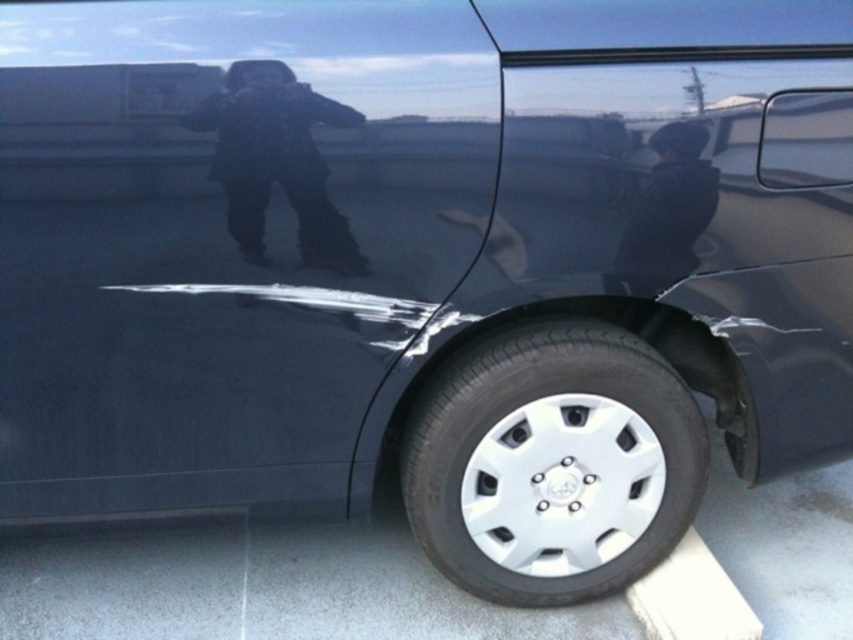
You are a delivery person who needs to place a package on the car shown in the image. The package requires a flat surface at least 0.3 meters wide. Can you place it on the black textured coat at upper center?

The black textured coat at upper center is located at point (x=276, y=161). Since the required width is 0.3 meters, and the exact dimensions of the coat are not provided, it is uncertain if it meets the requirement. Check the coat size before placing the package.

You are standing in front of the damaged car and want to touch both points on the car. Which point should you reach first, point [467,524] or point [712,188]?

You should reach point [712,188] first because it is closer to you than point [467,524], which is further away.

You are a mechanic working on a car. You need to place a tool that is 60 centimeters long between the silver metallic wheel at lower center and the black textured coat at upper center. Will the tool fit between them without overlapping either object?

The silver metallic wheel at lower center is 60.13 centimeters away from the black textured coat at upper center. Since the tool is 60 centimeters long, it will fit between them without overlapping either object because the distance is slightly longer than the tool.